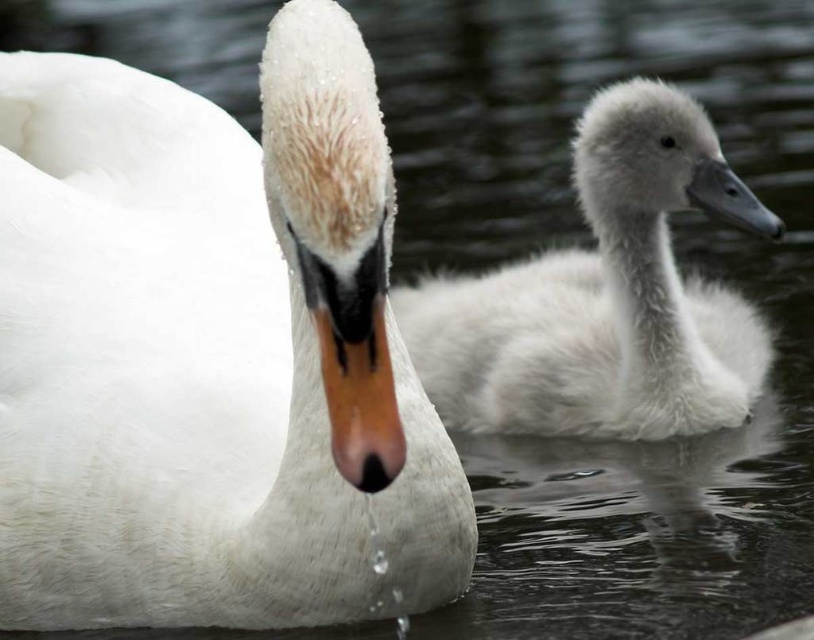
Question: In this image, where is white fluffy swan at left located relative to white fluffy swan at right?

Choices:
 (A) below
 (B) above

Answer: (A)

Question: Observing the image, what is the correct spatial positioning of white fluffy swan at left in reference to white fluffy swan at right?

Choices:
 (A) left
 (B) right

Answer: (A)

Question: Does white fluffy swan at left have a lesser width compared to white fluffy swan at right?

Choices:
 (A) no
 (B) yes

Answer: (B)

Question: Which point is farther to the camera?

Choices:
 (A) (475, 330)
 (B) (101, 349)

Answer: (A)